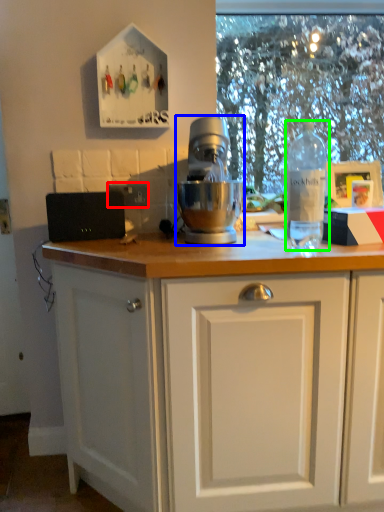
Question: Considering the real-world distances, which object is farthest from electric outlet (highlighted by a red box)? mixer (highlighted by a blue box) or bottle (highlighted by a green box)?

Choices:
 (A) mixer
 (B) bottle

Answer: (B)